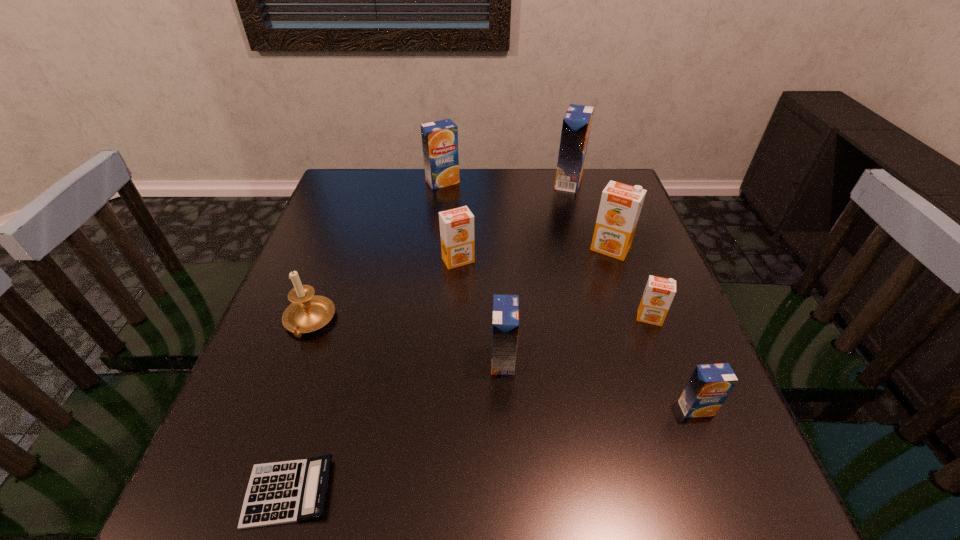
Where is `free point at the left edge`? The height and width of the screenshot is (540, 960). free point at the left edge is located at coordinates (335, 228).

In the image, there is a desktop. Where is `vacant space at the right edge`? The height and width of the screenshot is (540, 960). vacant space at the right edge is located at coordinates (655, 457).

Image resolution: width=960 pixels, height=540 pixels. I want to click on vacant space at the far left corner of the desktop, so tap(381, 197).

Locate an element on the screen. This screenshot has height=540, width=960. vacant area that lies between the second nearest orange juice and the tallest orange juice is located at coordinates point(536,271).

Image resolution: width=960 pixels, height=540 pixels. In order to click on empty location between the nearest object and the second biggest blue orange_juice in this screenshot , I will do `click(366, 337)`.

The height and width of the screenshot is (540, 960). I want to click on vacant area that lies between the tallest object and the leftmost blue orange_juice, so click(x=506, y=182).

Locate an element on the screen. Image resolution: width=960 pixels, height=540 pixels. empty location between the beige candle holder and the calculator is located at coordinates (299, 407).

I want to click on free space between the biggest orange orange juice and the candle holder, so click(460, 285).

At what (x,y) coordinates should I click in order to perform the action: click on free spot between the third blue orange_juice from right to left and the second biggest orange orange juice. Please return your answer as a coordinate pair (x, y). This screenshot has height=540, width=960. Looking at the image, I should click on (481, 310).

Identify the location of empty space that is in between the beige candle holder and the shortest object. The height and width of the screenshot is (540, 960). (299, 407).